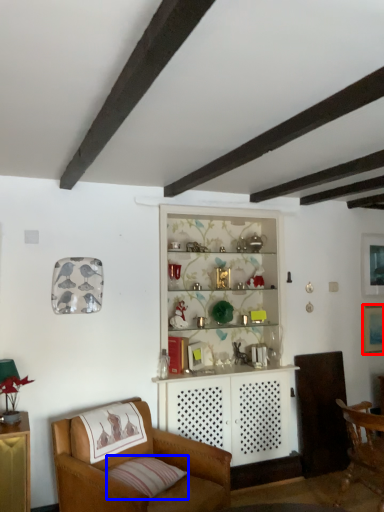
Question: Among these objects, which one is nearest to the camera, picture frame (highlighted by a red box) or pillow (highlighted by a blue box)?

Choices:
 (A) picture frame
 (B) pillow

Answer: (B)